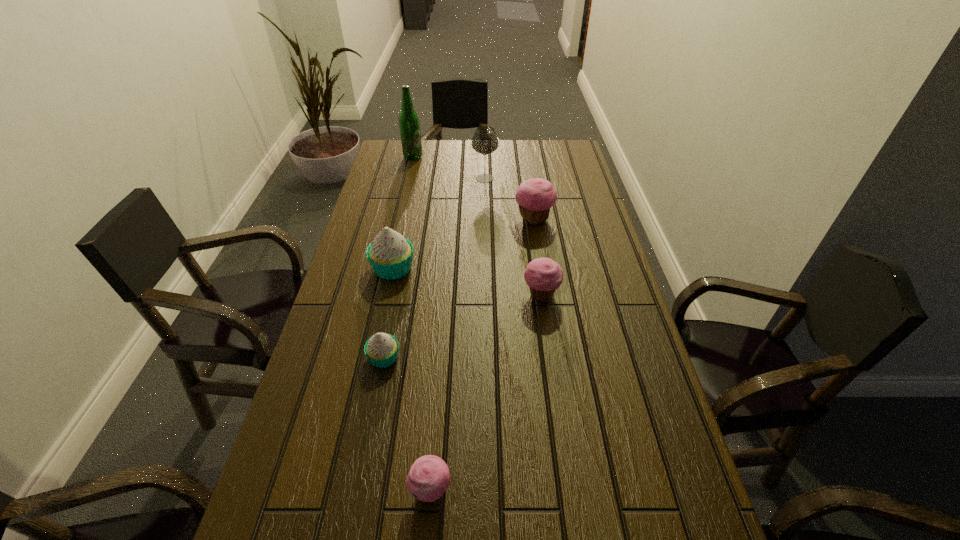
Where is `object present at the far edge`? object present at the far edge is located at coordinates (409, 124).

The height and width of the screenshot is (540, 960). In order to click on beer bottle at the left edge in this screenshot , I will do `click(409, 124)`.

This screenshot has height=540, width=960. I want to click on object at the right edge, so click(535, 197).

Where is `object that is at the far left corner`? object that is at the far left corner is located at coordinates (409, 124).

In the image, there is a desktop. Identify the location of vacant space at the far edge. (465, 164).

Find the location of `free region at the left edge of the desktop`. free region at the left edge of the desktop is located at coordinates (394, 290).

Locate an element on the screen. vacant space at the right edge of the desktop is located at coordinates (602, 345).

The height and width of the screenshot is (540, 960). I want to click on free space at the far right corner of the desktop, so click(565, 152).

Identify the location of unoccupied position between the leftmost pink cupcake and the third shortest object. (486, 393).

Where is `free space between the third farthest object and the third shortest cupcake`? This screenshot has height=540, width=960. free space between the third farthest object and the third shortest cupcake is located at coordinates (538, 258).